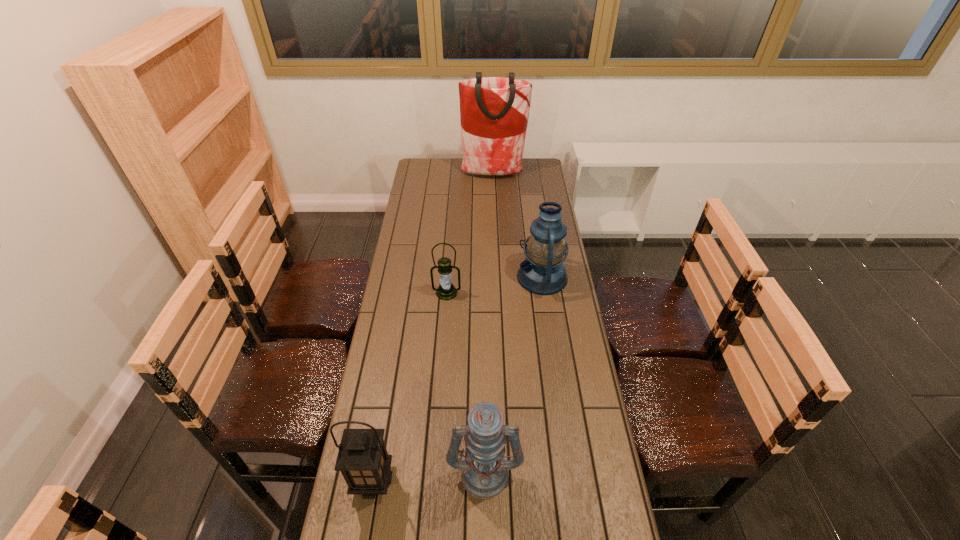
You are a GUI agent. You are given a task and a screenshot of the screen. Output one action in this format:
    pyautogui.click(x=<x>, y=<y>)
    Task: Click on the farthest object
    
    Given the screenshot: What is the action you would take?
    pyautogui.click(x=494, y=111)

Where is `grocery bag`? This screenshot has width=960, height=540. grocery bag is located at coordinates (494, 111).

Locate an element on the screen. The width and height of the screenshot is (960, 540). the rightmost lantern is located at coordinates (542, 272).

The width and height of the screenshot is (960, 540). I want to click on the leftmost lantern, so click(363, 460).

Find the location of `the shortest lantern`. the shortest lantern is located at coordinates (446, 291).

The height and width of the screenshot is (540, 960). Find the location of `vacant space located on the front of the tallest object`. vacant space located on the front of the tallest object is located at coordinates (495, 224).

Locate an element on the screen. blank space located 0.310m on the face of the rightmost lantern is located at coordinates coord(443,277).

You are a GUI agent. You are given a task and a screenshot of the screen. Output one action in this format:
    pyautogui.click(x=<x>, y=<y>)
    Task: Click on the free region located 0.210m on the face of the rightmost lantern
    The height and width of the screenshot is (540, 960).
    Given the screenshot: What is the action you would take?
    pyautogui.click(x=467, y=277)

Where is `free region located 0.370m on the face of the rightmost lantern`? The width and height of the screenshot is (960, 540). free region located 0.370m on the face of the rightmost lantern is located at coordinates (428, 277).

At what (x,y) coordinates should I click in order to perform the action: click on vacant space located 0.150m on the right of the leftmost lantern. Please return your answer as a coordinate pair (x, y). Looking at the image, I should click on (446, 480).